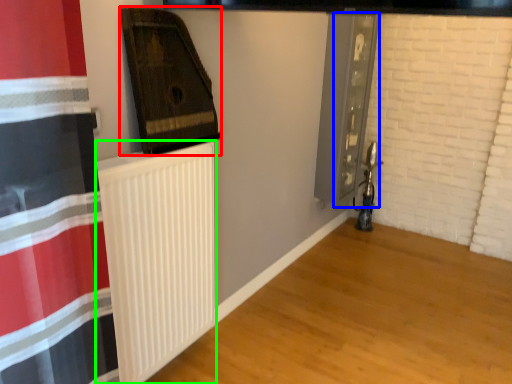
Question: Based on their relative distances, which object is nearer to wood (highlighted by a red box)? Choose from screen door (highlighted by a blue box) and radiator (highlighted by a green box).

Choices:
 (A) screen door
 (B) radiator

Answer: (B)